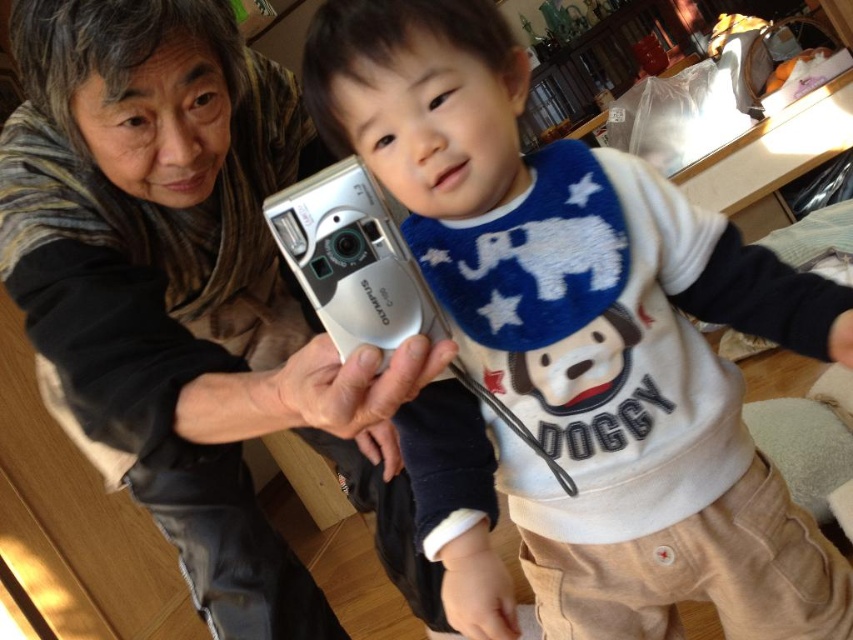
Question: Does white soft fabric bib at center lie in front of matte silver camera at center?

Choices:
 (A) yes
 (B) no

Answer: (B)

Question: Does white soft fabric bib at center come behind matte silver camera at center?

Choices:
 (A) no
 (B) yes

Answer: (B)

Question: Which point is closer to the camera taking this photo?

Choices:
 (A) (9, 172)
 (B) (498, 131)

Answer: (B)

Question: Is white soft fabric bib at center further to the viewer compared to matte silver camera at center?

Choices:
 (A) no
 (B) yes

Answer: (B)